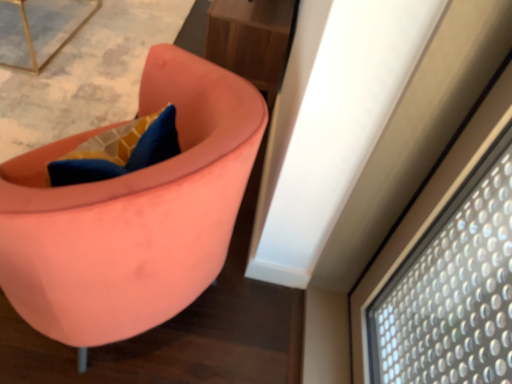
Question: Relative to metallic gold table at upper left, is wooden table at upper center in front or behind?

Choices:
 (A) front
 (B) behind

Answer: (B)

Question: From the image's perspective, relative to metallic gold table at upper left, is wooden table at upper center above or below?

Choices:
 (A) below
 (B) above

Answer: (A)

Question: Considering the real-world distances, which object is farthest from the metallic gold table at upper left?

Choices:
 (A) wooden table at upper center
 (B) matte pink chair at center

Answer: (B)

Question: Which of these objects is positioned closest to the matte pink chair at center?

Choices:
 (A) metallic gold table at upper left
 (B) wooden table at upper center

Answer: (B)